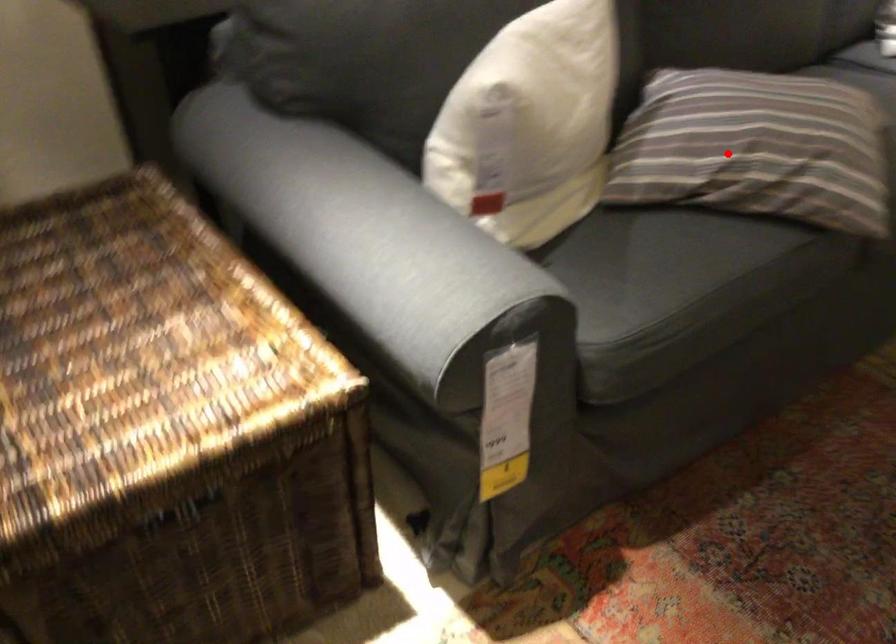
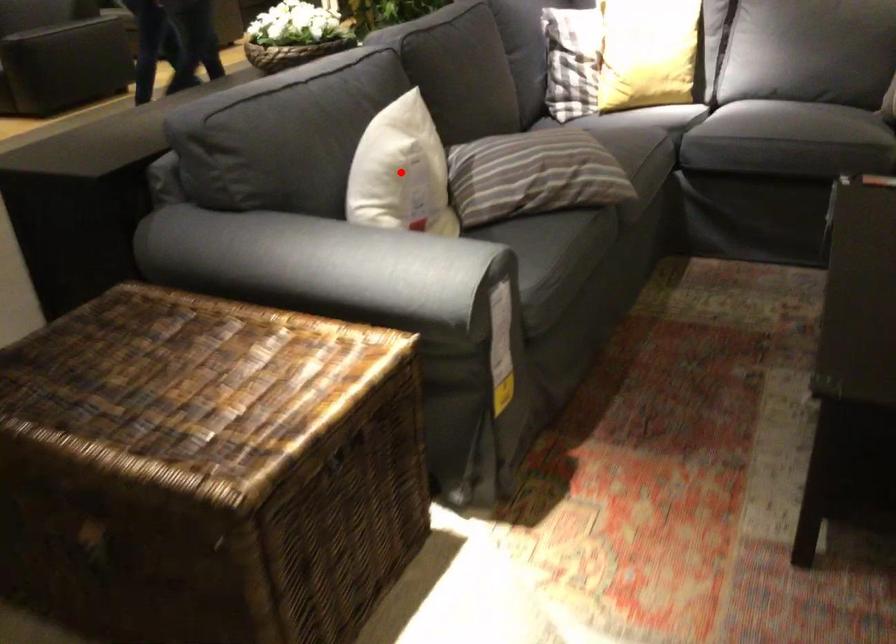
I am providing you with two images of the same scene from different viewpoints. A red point is marked on the first image and another point is marked on the second image. Is the red point in image1 aligned with the point shown in image2?

No